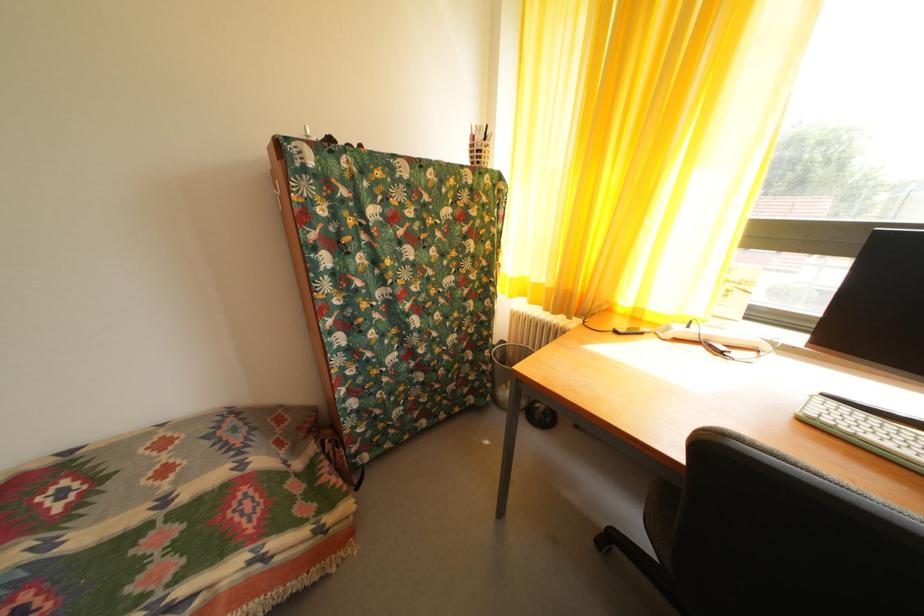
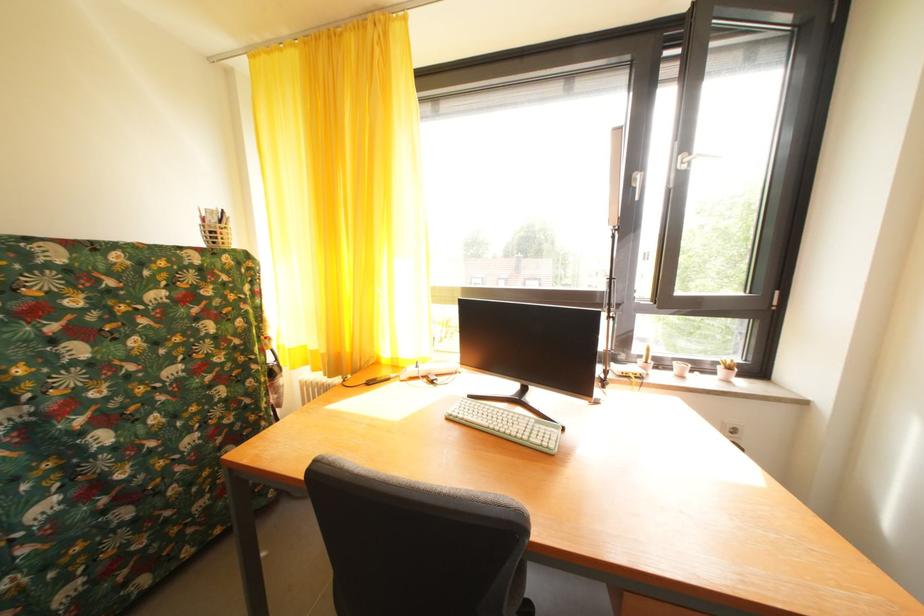
Find the pixel in the second image that matches point (478, 148) in the first image.

(209, 229)